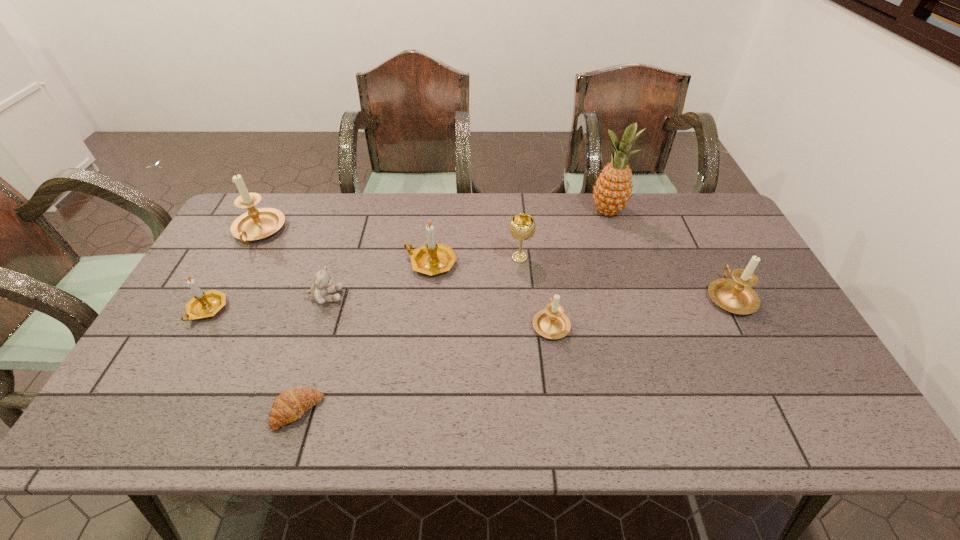
Where is `the second beige candle holder from right to left`? This screenshot has height=540, width=960. the second beige candle holder from right to left is located at coordinates pyautogui.click(x=552, y=323).

Locate an element on the screen. This screenshot has width=960, height=540. the left gold candle holder is located at coordinates [x=204, y=304].

At what (x,y) coordinates should I click in order to perform the action: click on the smaller gold candle holder. Please return your answer as a coordinate pair (x, y). Looking at the image, I should click on (204, 304).

The image size is (960, 540). I want to click on teddy bear, so click(x=321, y=287).

The height and width of the screenshot is (540, 960). What are the coordinates of `the eighth tallest object` in the screenshot? It's located at (321, 287).

Identify the location of crescent roll. The width and height of the screenshot is (960, 540). (290, 405).

You are a GUI agent. You are given a task and a screenshot of the screen. Output one action in this format:
    pyautogui.click(x=<x>, y=<y>)
    Task: Click on the brown crescent roll
    
    Given the screenshot: What is the action you would take?
    pyautogui.click(x=290, y=405)

Where is `blank area located on the front of the tallest object`? Image resolution: width=960 pixels, height=540 pixels. blank area located on the front of the tallest object is located at coordinates (632, 287).

The width and height of the screenshot is (960, 540). I want to click on free space located 0.240m with a handle on the side of the tallest candle holder, so click(x=216, y=312).

Identify the location of free space located 0.110m with a handle on the side of the rightmost beige candle holder. (706, 251).